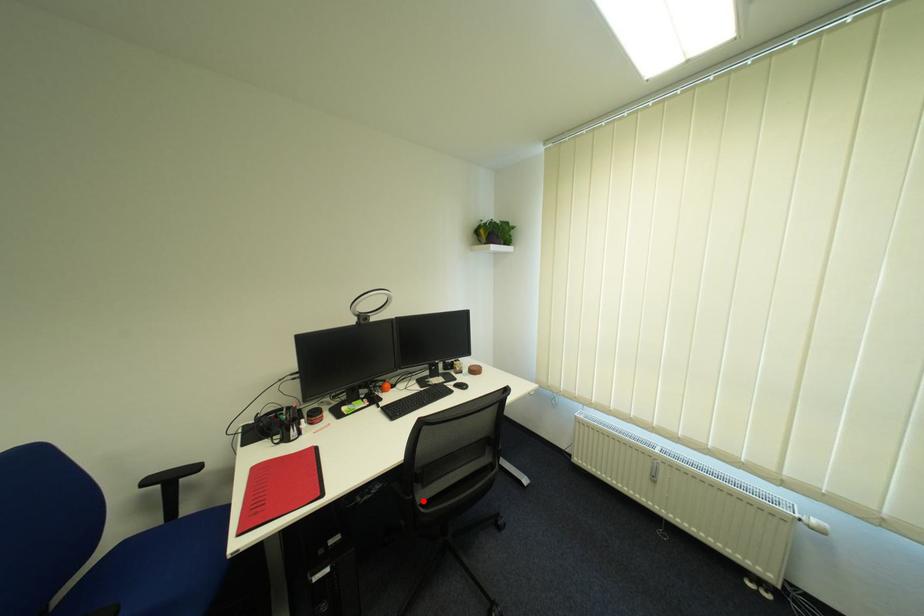
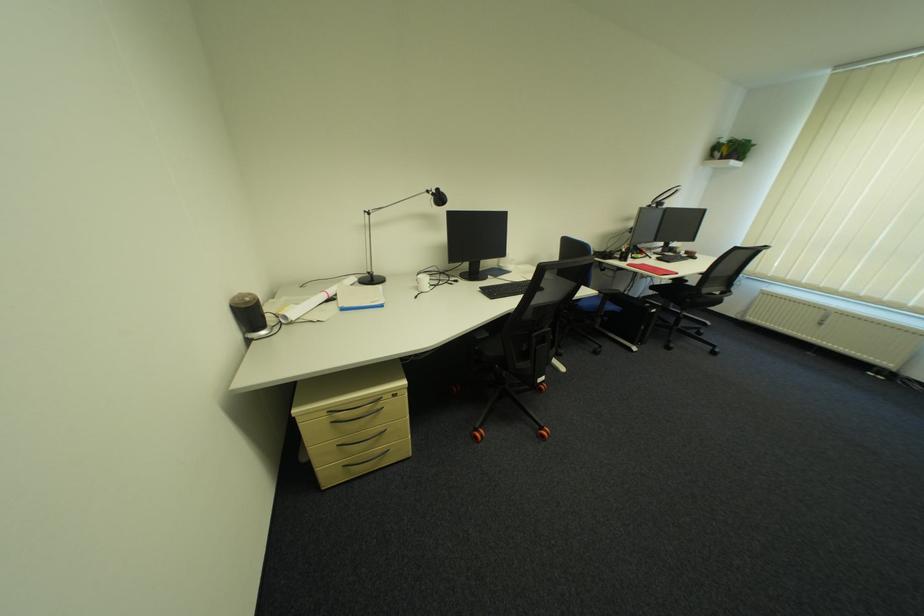
Question: I am providing you with two images of the same scene from different viewpoints. In image1, a red point is highlighted. Considering the same 3D point in image2, which of the following is correct?

Choices:
 (A) It is closer
 (B) It is farther

Answer: (A)